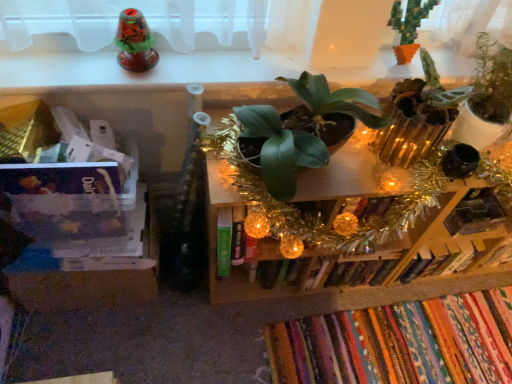
Question: Is clear plastic container at left, placed as the 1th shelf when sorted from left to right, smaller than green matte plant at center, the 3th houseplant from the right?

Choices:
 (A) yes
 (B) no

Answer: (B)

Question: Is green matte plant at center, the 3th houseplant from the right, at the back of clear plastic container at left, placed as the 1th shelf when sorted from left to right?

Choices:
 (A) no
 (B) yes

Answer: (A)

Question: From a real-world perspective, is clear plastic container at left, placed as the 1th shelf when sorted from left to right, located higher than green matte plant at center, the 3th houseplant from the right?

Choices:
 (A) no
 (B) yes

Answer: (A)

Question: From the image's perspective, does clear plastic container at left, which appears as the second shelf when viewed from the right, appear lower than green matte plant at center, the 3th houseplant from the right?

Choices:
 (A) yes
 (B) no

Answer: (A)

Question: Considering the relative positions of clear plastic container at left, which appears as the second shelf when viewed from the right, and green matte plant at center, which ranks as the first houseplant in left-to-right order, in the image provided, is clear plastic container at left, which appears as the second shelf when viewed from the right, to the right of green matte plant at center, which ranks as the first houseplant in left-to-right order, from the viewer's perspective?

Choices:
 (A) yes
 (B) no

Answer: (B)

Question: Do you think green pixelated cactus at upper right, which is the 2th houseplant in right-to-left order, is within clear plastic container at left, which appears as the second shelf when viewed from the right, or outside of it?

Choices:
 (A) inside
 (B) outside

Answer: (B)

Question: Is green pixelated cactus at upper right, the second houseplant when ordered from left to right, wider or thinner than clear plastic container at left, placed as the 1th shelf when sorted from left to right?

Choices:
 (A) wide
 (B) thin

Answer: (B)

Question: Is point (407, 13) positioned closer to the camera than point (123, 218)?

Choices:
 (A) farther
 (B) closer

Answer: (B)

Question: In terms of size, does green pixelated cactus at upper right, which is the 2th houseplant in right-to-left order, appear bigger or smaller than clear plastic container at left, placed as the 1th shelf when sorted from left to right?

Choices:
 (A) small
 (B) big

Answer: (A)

Question: Is green matte plant at center, which ranks as the first houseplant in left-to-right order, in front of or behind multicolored woven rug at lower right, placed as the 2th book when sorted from top to bottom, in the image?

Choices:
 (A) front
 (B) behind

Answer: (A)

Question: Choose the correct answer: Is green matte plant at center, which ranks as the first houseplant in left-to-right order, inside multicolored woven rug at lower right, placed as the 2th book when sorted from top to bottom, or outside it?

Choices:
 (A) outside
 (B) inside

Answer: (A)

Question: From a real-world perspective, is green matte plant at center, which ranks as the first houseplant in left-to-right order, above or below multicolored woven rug at lower right, marked as the first book in a bottom-to-top arrangement?

Choices:
 (A) above
 (B) below

Answer: (A)

Question: Does point (267, 107) appear closer or farther from the camera than point (403, 327)?

Choices:
 (A) closer
 (B) farther

Answer: (A)

Question: Is point (33, 249) positioned closer to the camera than point (478, 140)?

Choices:
 (A) closer
 (B) farther

Answer: (B)

Question: Is clear plastic container at left, which appears as the second shelf when viewed from the right, spatially inside green matte plant at upper right, the 3th houseplant viewed from the left, or outside of it?

Choices:
 (A) outside
 (B) inside

Answer: (A)